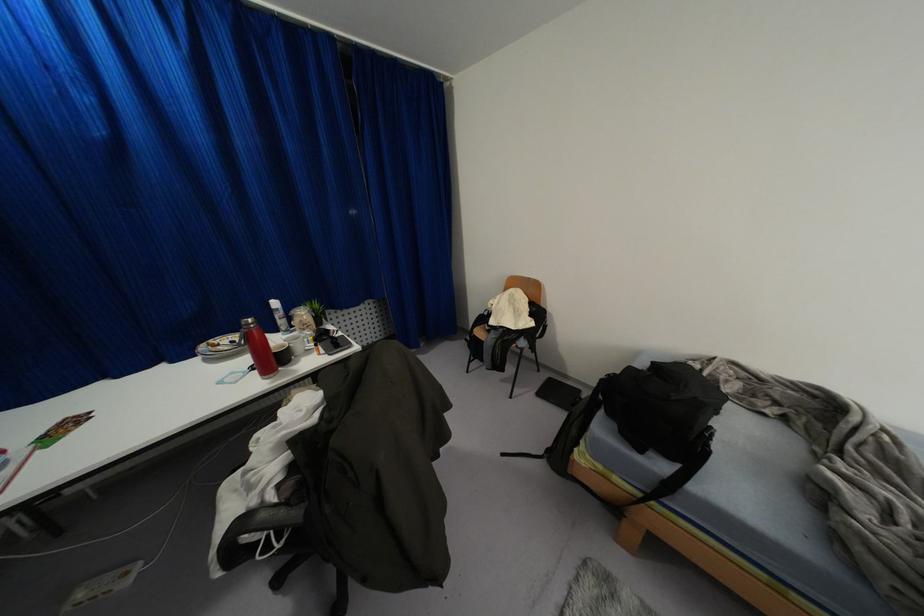
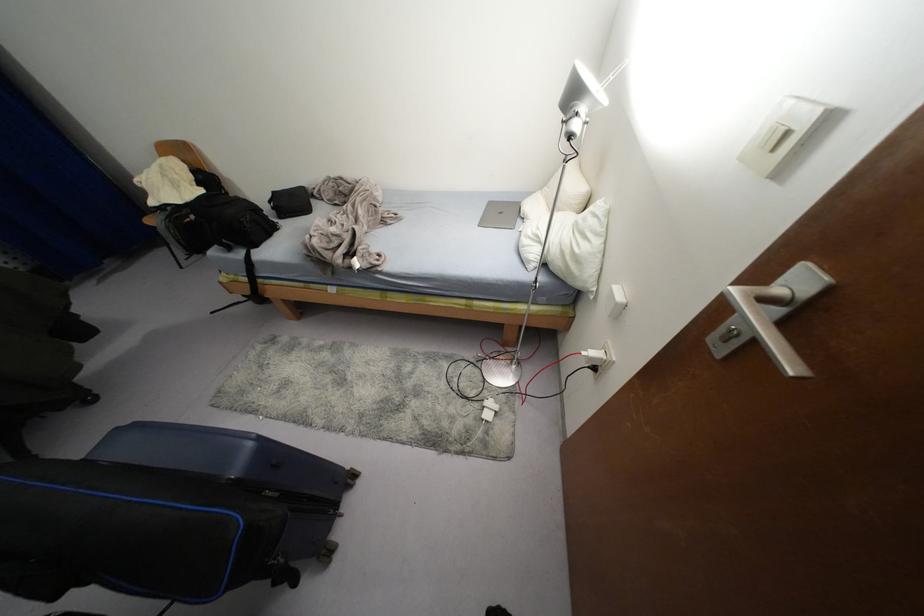
The point at [651,363] is marked in the first image. Where is the corresponding point in the second image?

(274, 192)